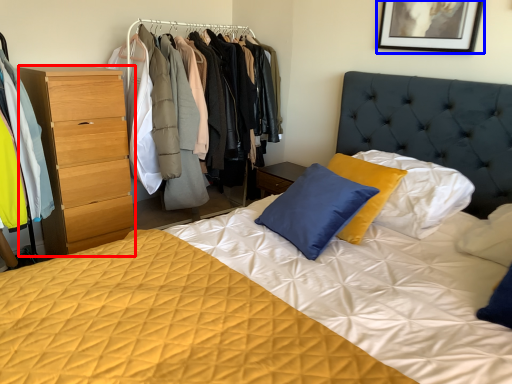
Question: Which point is further to the camera, chest of drawers (highlighted by a red box) or picture frame (highlighted by a blue box)?

Choices:
 (A) chest of drawers
 (B) picture frame

Answer: (A)